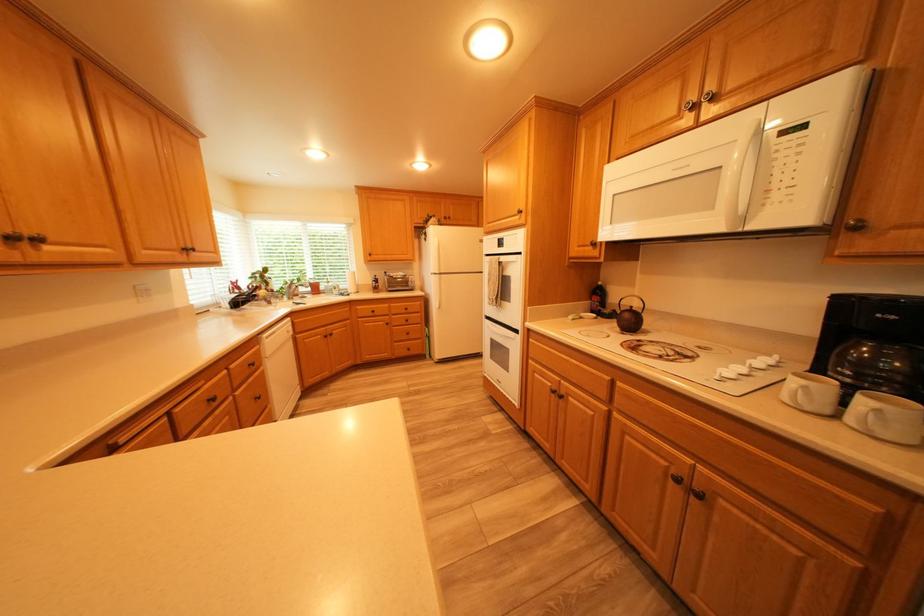
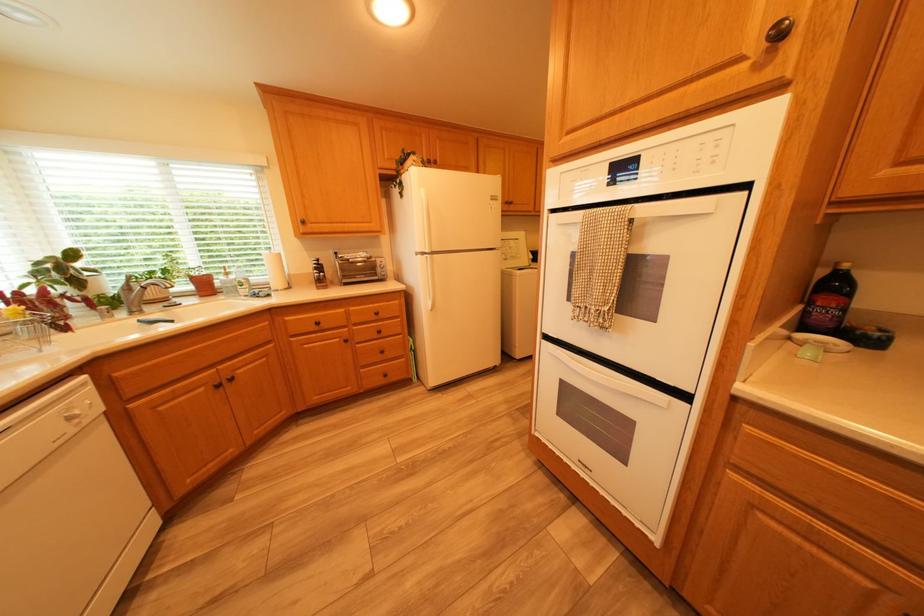
Locate, in the second image, the point that corresponds to point 517,260 in the first image.

(657, 211)